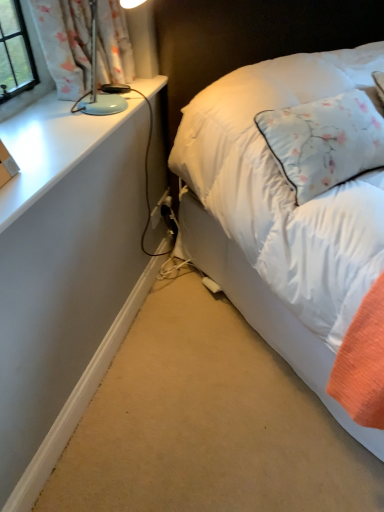
Find the location of a particular element. The width and height of the screenshot is (384, 512). free spot above matte blue lamp at upper left (from a real-world perspective) is located at coordinates (64, 135).